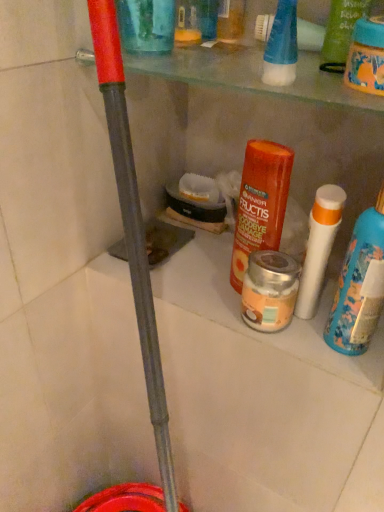
Question: From the image's perspective, is silver metallic jar at center, which is the third product from left to right, located above or below white matte bottle at right?

Choices:
 (A) below
 (B) above

Answer: (A)

Question: In terms of size, does silver metallic jar at center, which is the third product from left to right, appear bigger or smaller than white matte bottle at right?

Choices:
 (A) small
 (B) big

Answer: (A)

Question: Which object is positioned closest to the transparent plastic cup at upper center, placed as the fourth product when sorted from right to left?

Choices:
 (A) orange matte haircare product at center, which is counted as the 3th product, starting from the right
 (B) green matte shampoo at upper right, positioned as the first product in right-to-left order
 (C) white matte bottle at right
 (D) silver metallic jar at center, the 2th product in the right-to-left sequence
 (E) white matte tube at right

Answer: (B)

Question: Which object is the farthest from the green matte shampoo at upper right, positioned as the first product in right-to-left order?

Choices:
 (A) white matte bottle at right
 (B) silver metallic jar at center, which is the third product from left to right
 (C) white matte tube at right
 (D) transparent plastic cup at upper center, the 1th product viewed from the left
 (E) orange matte haircare product at center, which is counted as the 3th product, starting from the right

Answer: (B)